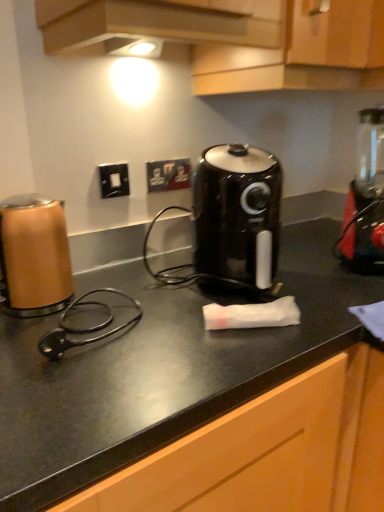
Question: Is copper metallic kettle at left positioned with its back to black plastic air fryer at center?

Choices:
 (A) no
 (B) yes

Answer: (A)

Question: Considering the relative sizes of copper metallic kettle at left and black plastic air fryer at center in the image provided, is copper metallic kettle at left taller than black plastic air fryer at center?

Choices:
 (A) yes
 (B) no

Answer: (B)

Question: From the image's perspective, does copper metallic kettle at left appear higher than black plastic air fryer at center?

Choices:
 (A) no
 (B) yes

Answer: (A)

Question: From a real-world perspective, is copper metallic kettle at left over black plastic air fryer at center?

Choices:
 (A) yes
 (B) no

Answer: (B)

Question: Could you tell me if copper metallic kettle at left is turned towards black plastic air fryer at center?

Choices:
 (A) yes
 (B) no

Answer: (B)

Question: From a real-world perspective, is red plastic blender at right positioned above or below black plastic air fryer at center?

Choices:
 (A) below
 (B) above

Answer: (B)

Question: Is red plastic blender at right to the left or to the right of black plastic air fryer at center in the image?

Choices:
 (A) left
 (B) right

Answer: (B)

Question: From the image's perspective, is red plastic blender at right positioned above or below black plastic air fryer at center?

Choices:
 (A) below
 (B) above

Answer: (B)

Question: Is red plastic blender at right in front of or behind black plastic air fryer at center in the image?

Choices:
 (A) front
 (B) behind

Answer: (B)

Question: Choose the correct answer: Is black matte countertop at center inside black plastic air fryer at center or outside it?

Choices:
 (A) outside
 (B) inside

Answer: (A)

Question: From the image's perspective, is black matte countertop at center located above or below black plastic air fryer at center?

Choices:
 (A) above
 (B) below

Answer: (B)

Question: Is black matte countertop at center in front of or behind black plastic air fryer at center in the image?

Choices:
 (A) behind
 (B) front

Answer: (B)

Question: Is point (339, 342) positioned closer to the camera than point (210, 262)?

Choices:
 (A) closer
 (B) farther

Answer: (A)

Question: Is point (1, 206) positioned closer to the camera than point (284, 54)?

Choices:
 (A) farther
 (B) closer

Answer: (B)

Question: From their relative heights in the image, would you say copper metallic kettle at left is taller or shorter than wooden cabinet at upper center?

Choices:
 (A) short
 (B) tall

Answer: (A)